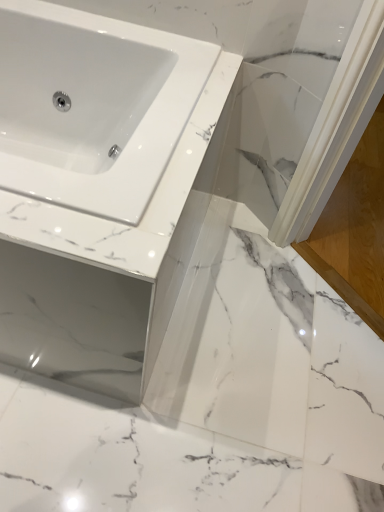
Where is `white marble screen door at lower right`? The image size is (384, 512). white marble screen door at lower right is located at coordinates (355, 230).

Describe the element at coordinates (355, 230) in the screenshot. The height and width of the screenshot is (512, 384). I see `white marble screen door at lower right` at that location.

The width and height of the screenshot is (384, 512). I want to click on white marble countertop at center, so click(107, 267).

Describe the element at coordinates (107, 267) in the screenshot. I see `white marble countertop at center` at that location.

Locate an element on the screen. Image resolution: width=384 pixels, height=512 pixels. white marble screen door at lower right is located at coordinates (355, 230).

Considering the positions of objects white marble countertop at center and white marble screen door at lower right in the image provided, who is more to the right, white marble countertop at center or white marble screen door at lower right?

white marble screen door at lower right is more to the right.

Relative to white marble screen door at lower right, is white marble countertop at center in front or behind?

In the image, white marble countertop at center appears in front of white marble screen door at lower right.

Is point (131, 311) positioned in front of point (366, 277)?

Yes, it is in front of point (366, 277).

From the image's perspective, between white marble countertop at center and white marble screen door at lower right, which one is located above?

white marble screen door at lower right is shown above in the image.

From a real-world perspective, is white marble countertop at center above or below white marble screen door at lower right?

white marble countertop at center is above white marble screen door at lower right.

Between white marble countertop at center and white marble screen door at lower right, which one has larger width?

white marble screen door at lower right.

Who is taller, white marble countertop at center or white marble screen door at lower right?

white marble countertop at center.

Can you confirm if white marble countertop at center is smaller than white marble screen door at lower right?

Incorrect, white marble countertop at center is not smaller in size than white marble screen door at lower right.

Is white marble countertop at center outside of white marble screen door at lower right?

Result: Yes, white marble countertop at center is not within white marble screen door at lower right.

Is white marble countertop at center positioned far away from white marble screen door at lower right?

white marble countertop at center is near white marble screen door at lower right, not far away.

Is white marble countertop at center oriented towards white marble screen door at lower right?

No, white marble countertop at center is not oriented towards white marble screen door at lower right.

What's the angular difference between white marble countertop at center and white marble screen door at lower right's facing directions?

The facing directions of white marble countertop at center and white marble screen door at lower right are 0.716 degrees apart.

Measure the distance from white marble countertop at center to white marble screen door at lower right.

The distance of white marble countertop at center from white marble screen door at lower right is 28.82 inches.

Where is `counter top that appears in front of the white marble screen door at lower right`? Image resolution: width=384 pixels, height=512 pixels. counter top that appears in front of the white marble screen door at lower right is located at coordinates (107, 267).

Which is more to the left, white marble screen door at lower right or white marble countertop at center?

Positioned to the left is white marble countertop at center.

Does white marble screen door at lower right lie in front of white marble countertop at center?

No, it is not.

Does point (374, 227) appear closer or farther from the camera than point (53, 339)?

Point (374, 227).

From the image's perspective, between white marble screen door at lower right and white marble countertop at center, which one is located above?

white marble screen door at lower right, from the image's perspective.

From a real-world perspective, which object stands above the other?

In real-world perspective, white marble countertop at center is above.

Can you confirm if white marble screen door at lower right is thinner than white marble countertop at center?

Incorrect, the width of white marble screen door at lower right is not less than that of white marble countertop at center.

Is white marble screen door at lower right shorter than white marble countertop at center?

Indeed, white marble screen door at lower right has a lesser height compared to white marble countertop at center.

Based on their sizes in the image, would you say white marble screen door at lower right is bigger or smaller than white marble countertop at center?

Clearly, white marble screen door at lower right is smaller in size than white marble countertop at center.

Which is correct: white marble screen door at lower right is inside white marble countertop at center, or outside of it?

white marble screen door at lower right is not enclosed by white marble countertop at center.

Is white marble screen door at lower right with white marble countertop at center?

No, white marble screen door at lower right is not making contact with white marble countertop at center.

Is white marble screen door at lower right oriented away from white marble countertop at center?

No, white marble countertop at center is not at the back of white marble screen door at lower right.

Locate an element on the screen. screen door that is behind the white marble countertop at center is located at coordinates (355, 230).

Identify the location of screen door that appears below the white marble countertop at center (from a real-world perspective). (355, 230).

This screenshot has height=512, width=384. In order to click on counter top in front of the white marble screen door at lower right in this screenshot , I will do (x=107, y=267).